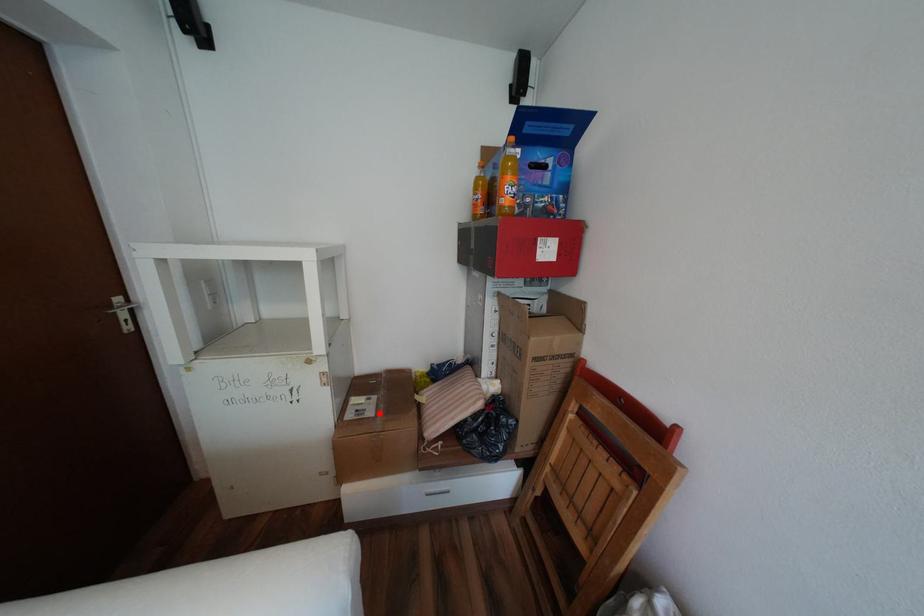
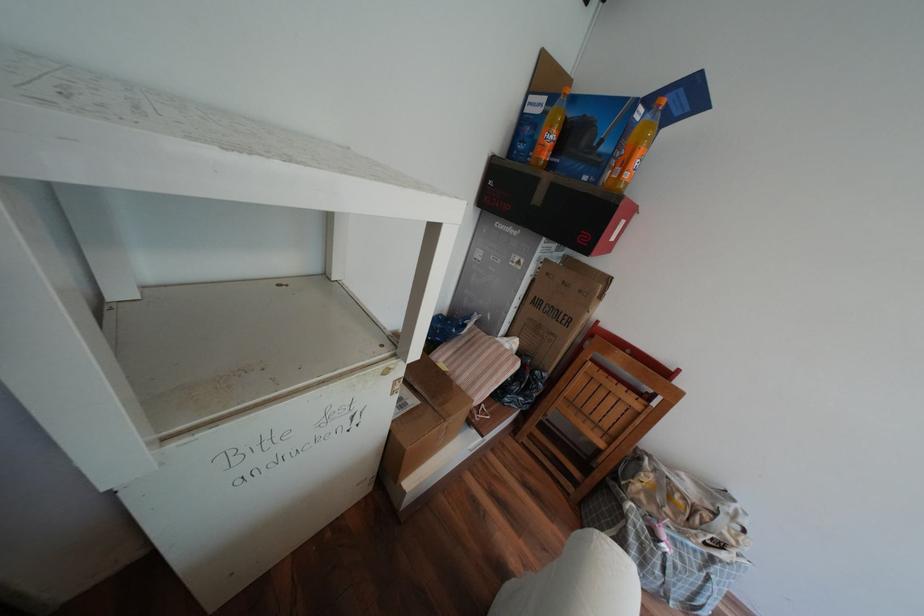
Question: I am providing you with two images of the same scene from different viewpoints. Image1 has a red point marked. In image2, the corresponding 3D location appears at what relative position? Reply with the corresponding letter.

Choices:
 (A) Closer
 (B) Farther

Answer: (B)